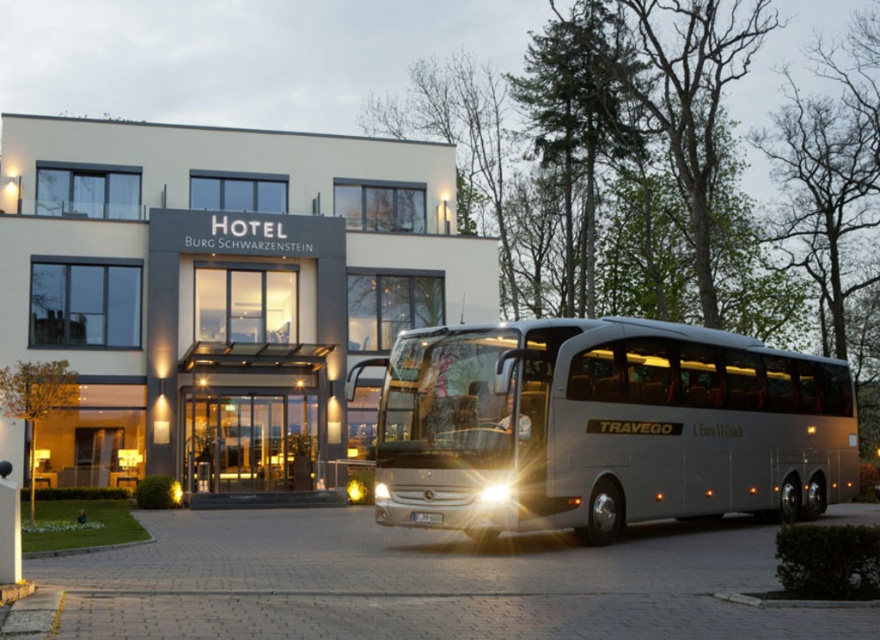
Question: Among these points, which one is farthest from the camera?

Choices:
 (A) (753, 456)
 (B) (110, 452)

Answer: (B)

Question: Where is white matte building at center located in relation to silver metallic coach at center in the image?

Choices:
 (A) right
 (B) left

Answer: (B)

Question: Where is white matte building at center located in relation to silver metallic coach at center in the image?

Choices:
 (A) below
 (B) above

Answer: (B)

Question: Can you confirm if white matte building at center is positioned above silver metallic coach at center?

Choices:
 (A) yes
 (B) no

Answer: (A)